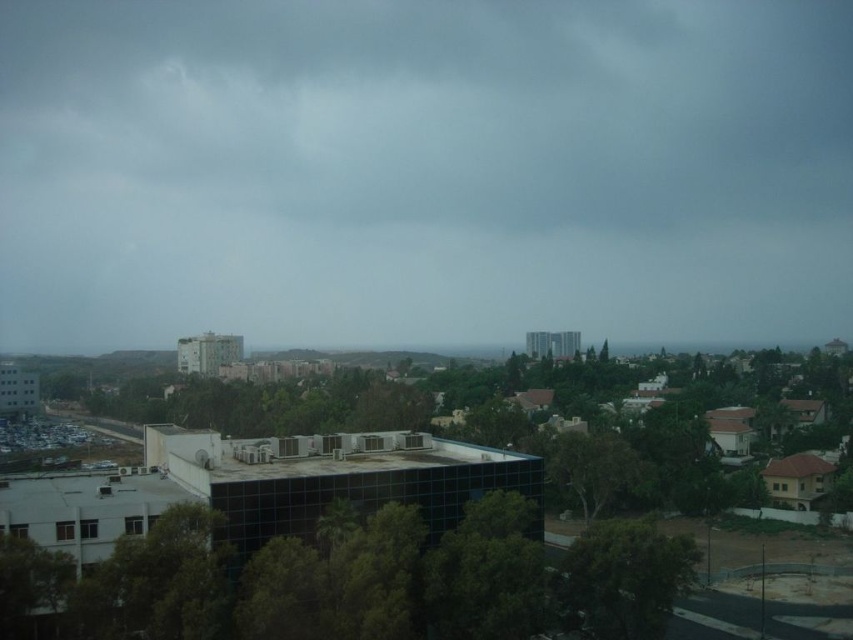
You are standing in the cityscape scene looking at the two points marked as point [161,193] and point [646,611]. Which point is closer to your viewpoint?

Point [161,193] is closer to your viewpoint because it is further to the camera than point [646,611].

You are standing in the city and looking at the dark gray cloud at upper center and the green leafy tree at center. Which object is closer to you?

The dark gray cloud at upper center is closer to you because it is further to the viewer than the green leafy tree at center.